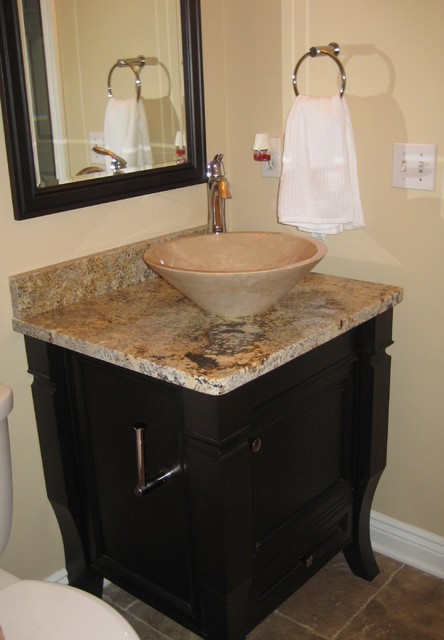
Locate an element on the screen. mirror is located at coordinates (123, 109).